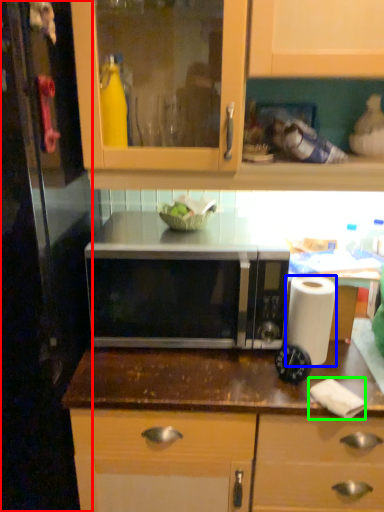
Question: Estimate the real-world distances between objects in this image. Which object is closer to glass door (highlighted by a red box), paper towel (highlighted by a blue box) or toilet paper (highlighted by a green box)?

Choices:
 (A) paper towel
 (B) toilet paper

Answer: (A)